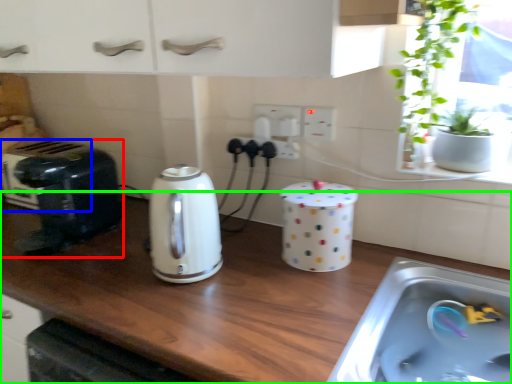
Question: Which is nearer to the toaster (highlighted by a red box)? appliance (highlighted by a blue box) or countertop (highlighted by a green box).

Choices:
 (A) appliance
 (B) countertop

Answer: (A)